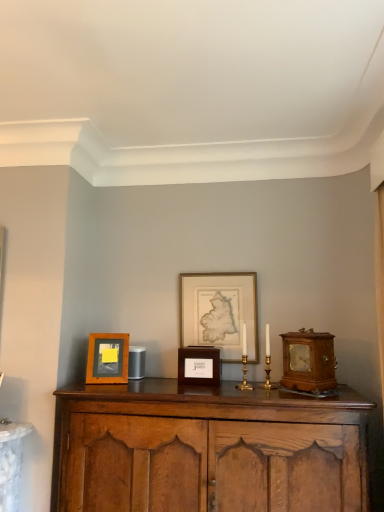
Locate an element on the screen. This screenshot has width=384, height=512. free spot in front of wooden frame at left, placed as the third picture frame when sorted from right to left is located at coordinates (112, 384).